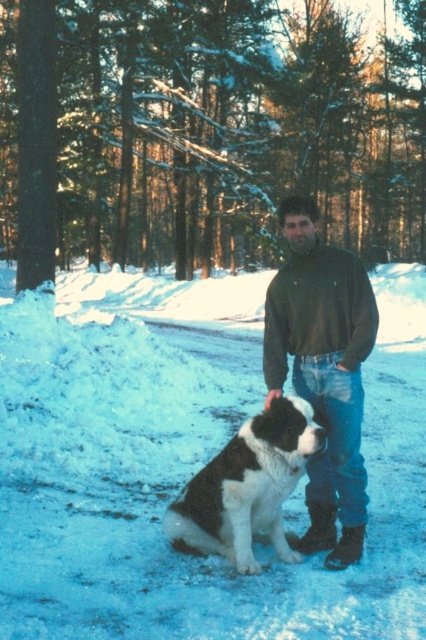
The height and width of the screenshot is (640, 426). In order to click on dark green sweater at center in this screenshot , I will do `click(324, 371)`.

Does dark green sweater at center come behind black and white fur at center?

Yes, it is behind black and white fur at center.

Who is more distant from viewer, (345, 490) or (267, 417)?

The point (345, 490) is behind.

Locate an element on the screen. dark green sweater at center is located at coordinates (324, 371).

Is point (46, 394) positioned after point (284, 468)?

Yes, it is.

Between point (370, 595) and point (204, 545), which one is positioned in front?

Point (370, 595) is more forward.

Image resolution: width=426 pixels, height=640 pixels. What are the coordinates of `white fluffy snow at center` in the screenshot? It's located at (176, 476).

Does white fluffy snow at center have a lesser height compared to dark green sweater at center?

No.

Between white fluffy snow at center and dark green sweater at center, which one appears on the right side from the viewer's perspective?

From the viewer's perspective, white fluffy snow at center appears more on the right side.

Between point (8, 512) and point (307, 545), which one is positioned behind?

Point (8, 512)

Where is `white fluffy snow at center`? white fluffy snow at center is located at coordinates (176, 476).